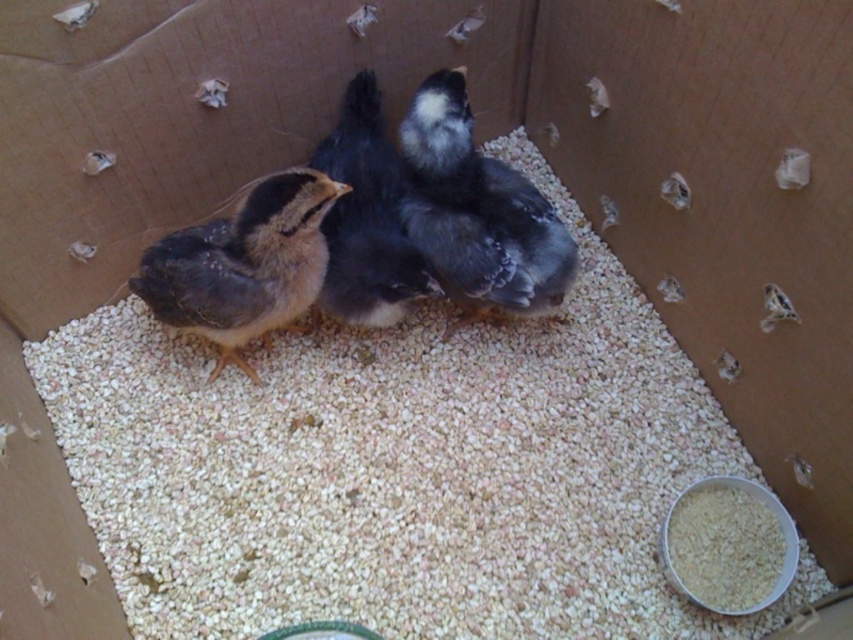
You are a poultry farmer checking the health of the chicks in the cardboard box. You notice two distinct features at the center of the box. Which feature is taller between the silvery gray feathers at center and the soft yellow down at center?

The silvery gray feathers at center is much taller than the soft yellow down at center.

You are a caretaker checking the bedding in the cardboard box for the baby chicks. You need to ensure there is enough space for the chicks to move comfortably. Given that the soft yellow down at center takes up more horizontal space than the white grain at lower right, which bedding material should you prioritize adding more of to ensure adequate space?

Since the soft yellow down at center is wider than the white grain at lower right, you should prioritize adding more of the white grain at lower right to create more space for the chicks to move comfortably.

You are a caretaker checking on the baby chicks in the cardboard box. You notice two items inside the box. One is the soft yellow down at center and the other is the white grain at lower right. Which item is higher in elevation compared to the other?

The soft yellow down at center is taller than the white grain at lower right, so the soft yellow down at center is higher in elevation.